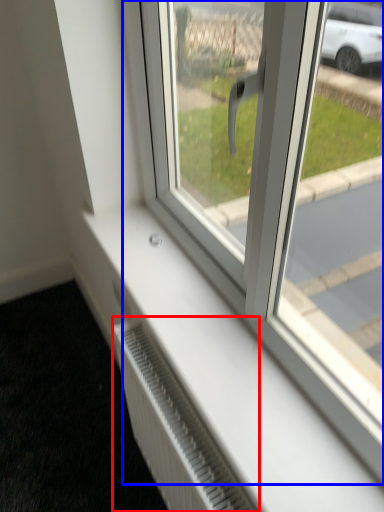
Question: Among these objects, which one is farthest to the camera, radiator (highlighted by a red box) or window (highlighted by a blue box)?

Choices:
 (A) radiator
 (B) window

Answer: (A)